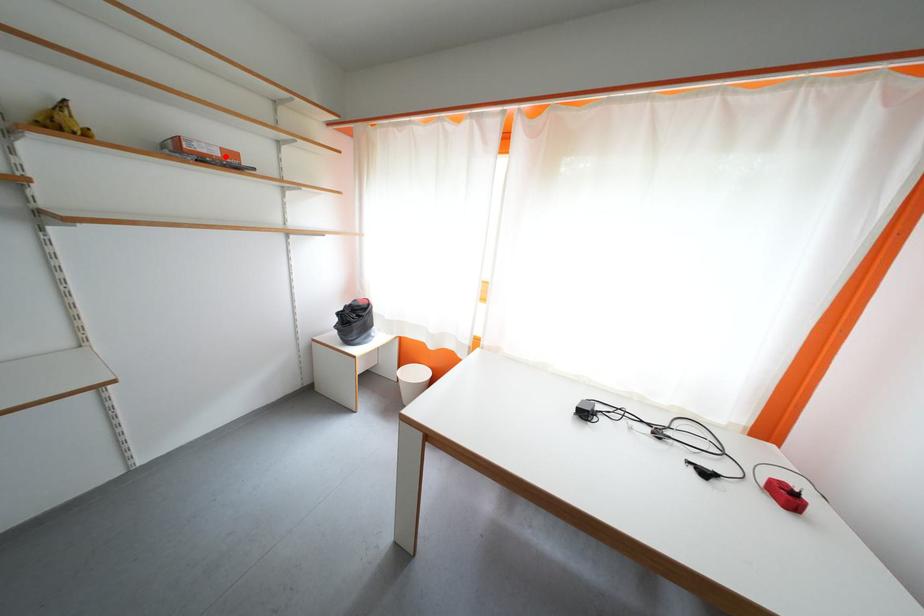
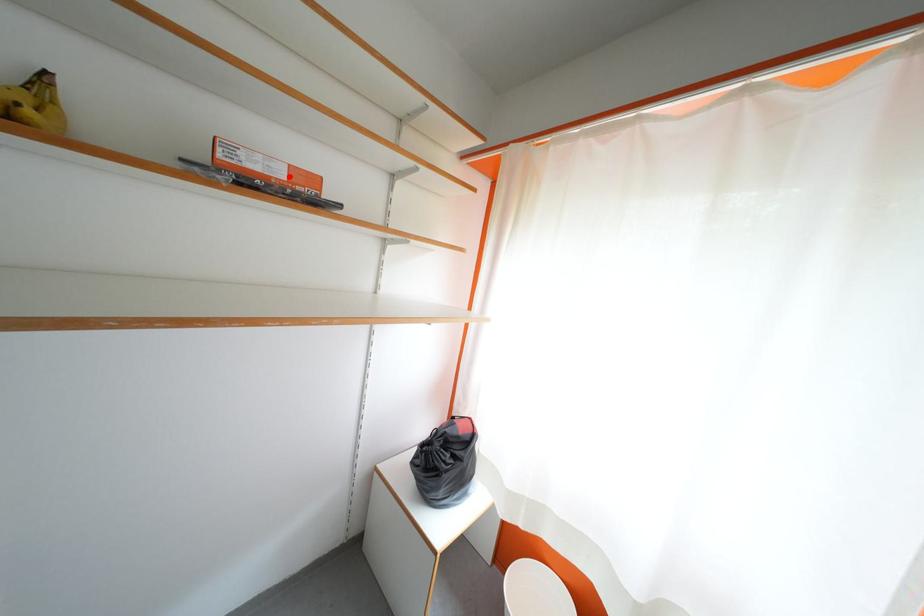
I am providing you with two images of the same scene from different viewpoints. A red point is marked on the first image and another point is marked on the second image. Does the point marked in image1 correspond to the same location as the one in image2?

Yes